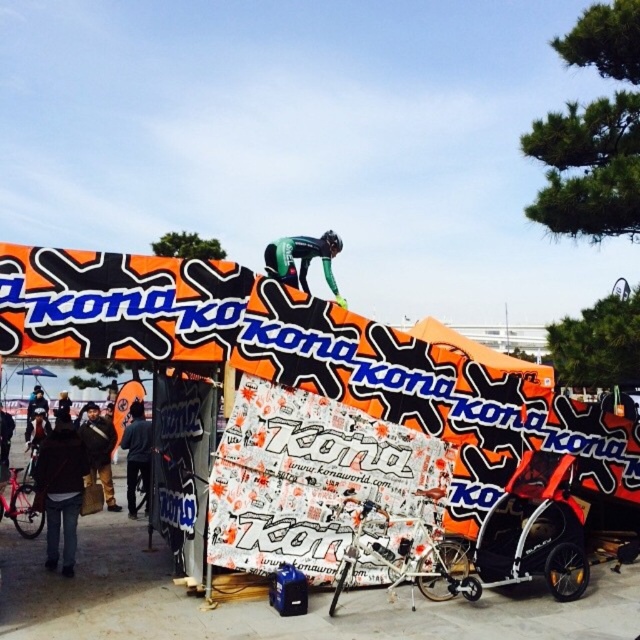
You are a participant in the event and need to retrieve your dark brown leather jacket at lower left. You are currently standing next to the matte black bicycle at left. Which direction should you move to reach the jacket?

The dark brown leather jacket at lower left is closer to the viewer than the matte black bicycle at left, so you should move forward towards the jacket since it is nearer to your current position.

You are a participant in the event and need to quickly grab your gear. Your green fabric suit at center is 4.39 meters away from your brown leather jacket at center. If you can move at a speed of 1 meter per second, how many seconds will it take you to reach the jacket from the suit?

The distance between the green fabric suit at center and the brown leather jacket at center is 4.39 meters. Moving at 1 meter per second, it would take approximately 4.39 seconds to reach the jacket from the suit.

You are an event organizer checking the setup. You need to place a rectangular box that is 2 feet wide between the dark brown leather jacket at lower left and the brown leather jacket at center. Based on their widths, can you determine if the box will fit between them?

The dark brown leather jacket at lower left might be wider than brown leather jacket at center, so the box that is 2 feet wide may or may not fit depending on the exact width difference between the two jackets.